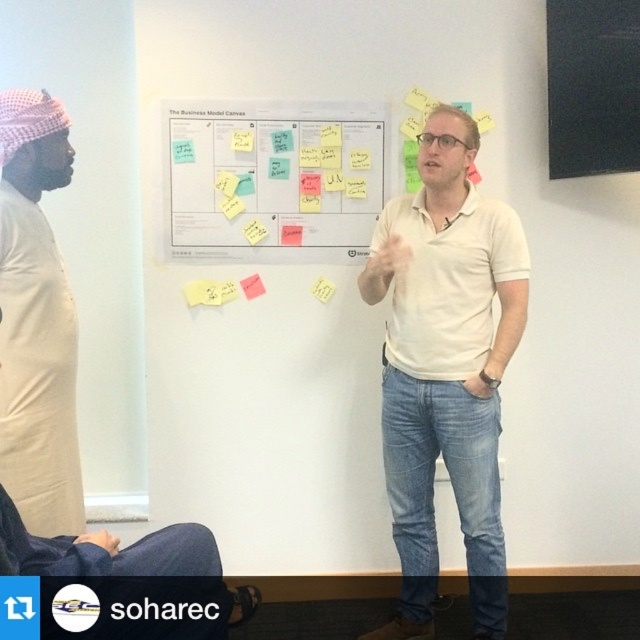
Measure the distance between beige cotton shirt at left and camera.

beige cotton shirt at left is 5.17 feet from camera.

Is point (4, 147) in front of point (328, 294)?

Yes, it is in front of point (328, 294).

The image size is (640, 640). I want to click on beige cotton shirt at left, so click(35, 321).

Locate an element on the screen. The height and width of the screenshot is (640, 640). beige cotton shirt at left is located at coordinates (35, 321).

Does white paperboard at center appear under beige cotton shirt at left?

No, white paperboard at center is not below beige cotton shirt at left.

Who is positioned more to the right, white paperboard at center or beige cotton shirt at left?

From the viewer's perspective, white paperboard at center appears more on the right side.

Where is `white paperboard at center`? This screenshot has width=640, height=640. white paperboard at center is located at coordinates (273, 179).

Describe the element at coordinates (445, 368) in the screenshot. I see `white cotton shirt at center` at that location.

Can you confirm if white cotton shirt at center is positioned above black matte board at upper right?

Actually, white cotton shirt at center is below black matte board at upper right.

Locate an element on the screen. white cotton shirt at center is located at coordinates (445, 368).

Locate an element on the screen. This screenshot has width=640, height=640. white cotton shirt at center is located at coordinates (445, 368).